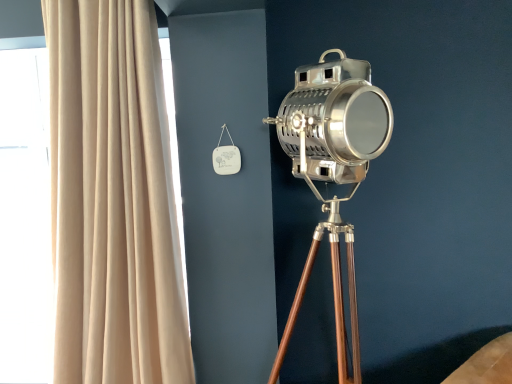
This screenshot has height=384, width=512. What do you see at coordinates (113, 199) in the screenshot? I see `beige fabric curtain at left` at bounding box center [113, 199].

Locate an element on the screen. The image size is (512, 384). beige fabric curtain at left is located at coordinates (113, 199).

Where is `beige fabric curtain at left`? beige fabric curtain at left is located at coordinates (113, 199).